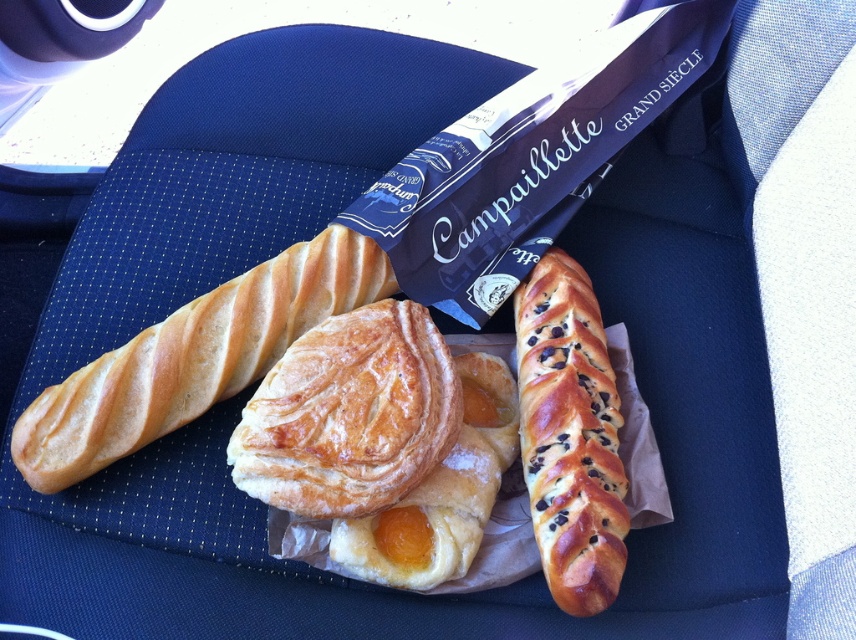
Question: Which object appears closest to the camera in this image?

Choices:
 (A) golden flaky pastry at center
 (B) golden-brown braided bread at center-right
 (C) golden brown flaky pastry at center
 (D) golden-brown flaky pastry at center

Answer: (D)

Question: Is golden-brown flaky pastry at center below golden-brown braided bread at center-right?

Choices:
 (A) yes
 (B) no

Answer: (B)

Question: In this image, where is golden-brown flaky pastry at center located relative to golden flaky pastry at center?

Choices:
 (A) above
 (B) below

Answer: (A)

Question: Among these objects, which one is nearest to the camera?

Choices:
 (A) golden brown flaky pastry at center
 (B) golden flaky pastry at center
 (C) golden-brown braided bread at center-right
 (D) golden-brown flaky pastry at center

Answer: (D)

Question: Observing the image, what is the correct spatial positioning of golden-brown flaky pastry at center in reference to golden-brown braided bread at center-right?

Choices:
 (A) left
 (B) right

Answer: (A)

Question: Among these points, which one is nearest to the camera?

Choices:
 (A) tap(342, 330)
 (B) tap(46, 426)

Answer: (B)